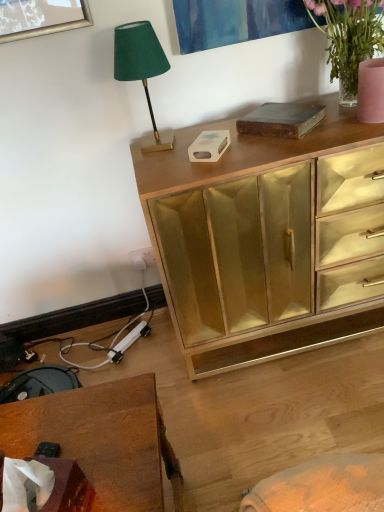
Find the location of a particular element. This screenshot has height=512, width=384. gold mirrored cabinet at upper center is located at coordinates (268, 240).

Locate an element on the screen. This screenshot has width=384, height=512. green velvet lampshade at upper left is located at coordinates (142, 70).

The image size is (384, 512). I want to click on translucent glass vase at upper right, so click(349, 38).

From the image's perspective, is gold mirrored cabinet at upper center below wooden desk at lower left?

No, from the image's perspective, gold mirrored cabinet at upper center is not below wooden desk at lower left.

Which is correct: gold mirrored cabinet at upper center is inside wooden desk at lower left, or outside of it?

gold mirrored cabinet at upper center lies outside wooden desk at lower left.

From a real-world perspective, is gold mirrored cabinet at upper center located beneath wooden desk at lower left?

No, from a real-world perspective, gold mirrored cabinet at upper center is not below wooden desk at lower left.

Is gold mirrored cabinet at upper center shorter than wooden desk at lower left?

No, gold mirrored cabinet at upper center is not shorter than wooden desk at lower left.

Find the location of a particular element. Image resolution: width=384 pixels, height=512 pixels. the chest of drawers behind the translucent glass vase at upper right is located at coordinates (268, 240).

Looking at this image, from the image's perspective, is translucent glass vase at upper right located above or below gold mirrored cabinet at upper center?

translucent glass vase at upper right is above gold mirrored cabinet at upper center.

Considering the points (356, 19) and (178, 149), which point is in front, point (356, 19) or point (178, 149)?

The point (356, 19) is closer.

Considering the sizes of translucent glass vase at upper right and gold mirrored cabinet at upper center in the image, is translucent glass vase at upper right taller or shorter than gold mirrored cabinet at upper center?

Clearly, translucent glass vase at upper right is shorter compared to gold mirrored cabinet at upper center.

Is green velvet lampshade at upper left to the right of gold mirrored cabinet at upper center from the viewer's perspective?

No.

Is gold mirrored cabinet at upper center a part of green velvet lampshade at upper left?

No, gold mirrored cabinet at upper center is not surrounded by green velvet lampshade at upper left.

How different are the orientations of green velvet lampshade at upper left and gold mirrored cabinet at upper center in degrees?

The facing directions of green velvet lampshade at upper left and gold mirrored cabinet at upper center are 1.74 degrees apart.

From the image's perspective, is green velvet lampshade at upper left beneath gold mirrored cabinet at upper center?

No.

Looking at this image, does gold mirrored cabinet at upper center have a smaller size compared to green velvet lampshade at upper left?

No, gold mirrored cabinet at upper center is not smaller than green velvet lampshade at upper left.

Identify the location of chest of drawers below the green velvet lampshade at upper left (from a real-world perspective). This screenshot has width=384, height=512. (268, 240).

From the image's perspective, is gold mirrored cabinet at upper center on green velvet lampshade at upper left?

No, from the image's perspective, gold mirrored cabinet at upper center is not on top of green velvet lampshade at upper left.

Between gold mirrored cabinet at upper center and green velvet lampshade at upper left, which one is positioned behind?

green velvet lampshade at upper left is further from the camera.

Does wooden desk at lower left have a smaller size compared to gold mirrored cabinet at upper center?

Yes.

From the image's perspective, is wooden desk at lower left beneath gold mirrored cabinet at upper center?

Indeed, from the image's perspective, wooden desk at lower left is shown beneath gold mirrored cabinet at upper center.

Which point is more forward, (x=86, y=431) or (x=203, y=287)?

Point (x=86, y=431)

Relative to gold mirrored cabinet at upper center, is wooden desk at lower left in front or behind?

Clearly, wooden desk at lower left is in front of gold mirrored cabinet at upper center.

Image resolution: width=384 pixels, height=512 pixels. I want to click on lamp located on the left of translucent glass vase at upper right, so click(142, 70).

How much distance is there between green velvet lampshade at upper left and translucent glass vase at upper right?

A distance of 55.90 centimeters exists between green velvet lampshade at upper left and translucent glass vase at upper right.

Between green velvet lampshade at upper left and translucent glass vase at upper right, which one appears on the left side from the viewer's perspective?

green velvet lampshade at upper left is more to the left.

From the image's perspective, is green velvet lampshade at upper left beneath translucent glass vase at upper right?

Yes, from the image's perspective, green velvet lampshade at upper left is beneath translucent glass vase at upper right.

Looking at this image, from a real-world perspective, which is physically below, translucent glass vase at upper right or green velvet lampshade at upper left?

translucent glass vase at upper right.

Considering their positions, is translucent glass vase at upper right located in front of or behind green velvet lampshade at upper left?

translucent glass vase at upper right is positioned closer to the viewer than green velvet lampshade at upper left.

Which is behind, point (367, 31) or point (120, 36)?

Point (367, 31)

Where is `the chest of drawers above the wooden desk at lower left (from the image's perspective)`? The image size is (384, 512). the chest of drawers above the wooden desk at lower left (from the image's perspective) is located at coordinates (268, 240).

Find the location of a particular element. The height and width of the screenshot is (512, 384). chest of drawers on the left of translucent glass vase at upper right is located at coordinates (x=268, y=240).

Considering their positions, is gold mirrored cabinet at upper center positioned further to green velvet lampshade at upper left than wooden desk at lower left?

wooden desk at lower left.

From the image, which object appears to be nearer to wooden desk at lower left, translucent glass vase at upper right or green velvet lampshade at upper left?

The object closer to wooden desk at lower left is green velvet lampshade at upper left.

When comparing their distances from green velvet lampshade at upper left, does translucent glass vase at upper right or gold mirrored cabinet at upper center seem closer?

The object closer to green velvet lampshade at upper left is gold mirrored cabinet at upper center.

Estimate the real-world distances between objects in this image. Which object is closer to gold mirrored cabinet at upper center, wooden desk at lower left or green velvet lampshade at upper left?

Based on the image, green velvet lampshade at upper left appears to be nearer to gold mirrored cabinet at upper center.

Which object lies nearer to the anchor point wooden desk at lower left, green velvet lampshade at upper left or gold mirrored cabinet at upper center?

gold mirrored cabinet at upper center lies closer to wooden desk at lower left than the other object.

Consider the image. Which object lies further to the anchor point gold mirrored cabinet at upper center, green velvet lampshade at upper left or translucent glass vase at upper right?

The object further to gold mirrored cabinet at upper center is translucent glass vase at upper right.

From the image, which object appears to be nearer to gold mirrored cabinet at upper center, wooden desk at lower left or translucent glass vase at upper right?

Based on the image, translucent glass vase at upper right appears to be nearer to gold mirrored cabinet at upper center.

Based on their spatial positions, is translucent glass vase at upper right or green velvet lampshade at upper left closer to gold mirrored cabinet at upper center?

Based on the image, green velvet lampshade at upper left appears to be nearer to gold mirrored cabinet at upper center.

Identify the location of chest of drawers between green velvet lampshade at upper left and wooden desk at lower left in the vertical direction. (268, 240).

Where is `the chest of drawers that lies between translucent glass vase at upper right and wooden desk at lower left from top to bottom`? The height and width of the screenshot is (512, 384). the chest of drawers that lies between translucent glass vase at upper right and wooden desk at lower left from top to bottom is located at coordinates (268, 240).

The height and width of the screenshot is (512, 384). What are the coordinates of `lamp between translucent glass vase at upper right and wooden desk at lower left from top to bottom` in the screenshot? It's located at (142, 70).

At what (x,y) coordinates should I click in order to perform the action: click on the chest of drawers located between green velvet lampshade at upper left and translucent glass vase at upper right in the left-right direction. Please return your answer as a coordinate pair (x, y). The width and height of the screenshot is (384, 512). Looking at the image, I should click on [x=268, y=240].